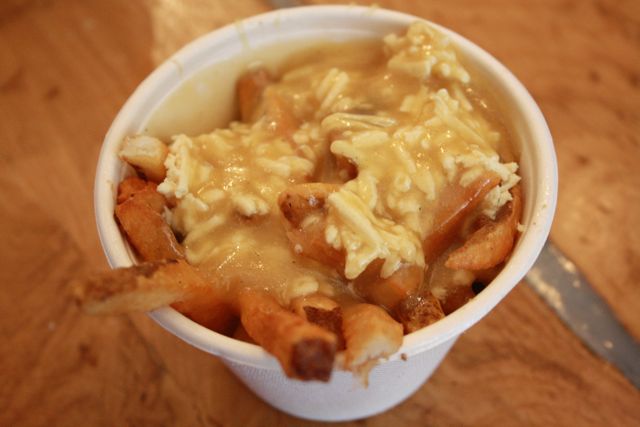
What are the coordinates of `wooden table` in the screenshot? It's located at (515, 408).